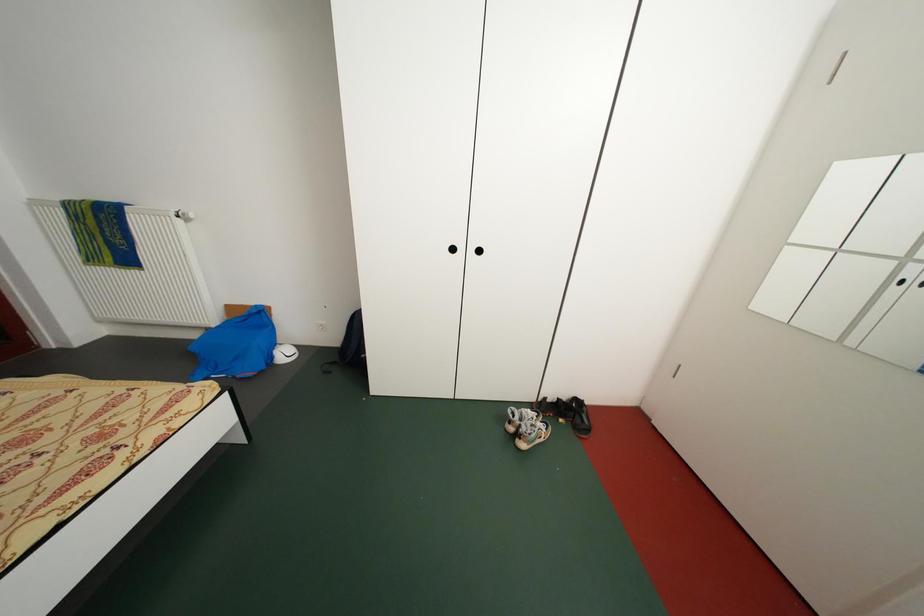
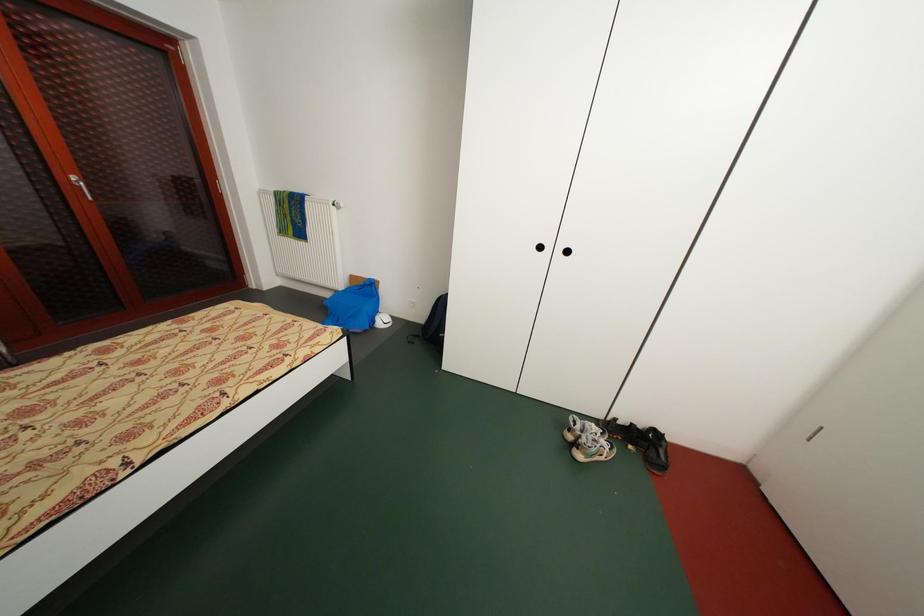
Question: Which direction would the cameraman need to move to produce the second image? Reply with the corresponding letter.

Choices:
 (A) Left
 (B) Right
 (C) Forward
 (D) Backward

Answer: (D)